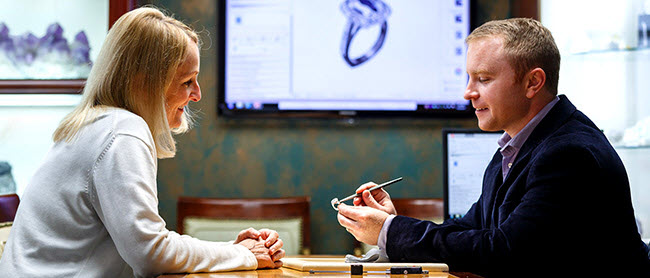
Identify the location of chair. (227, 212), (10, 208), (422, 209), (649, 249).